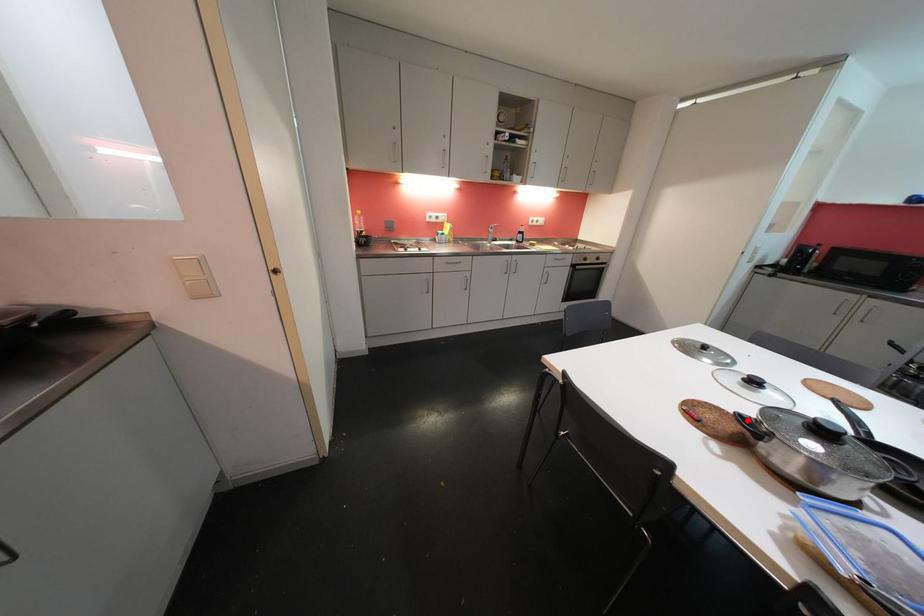
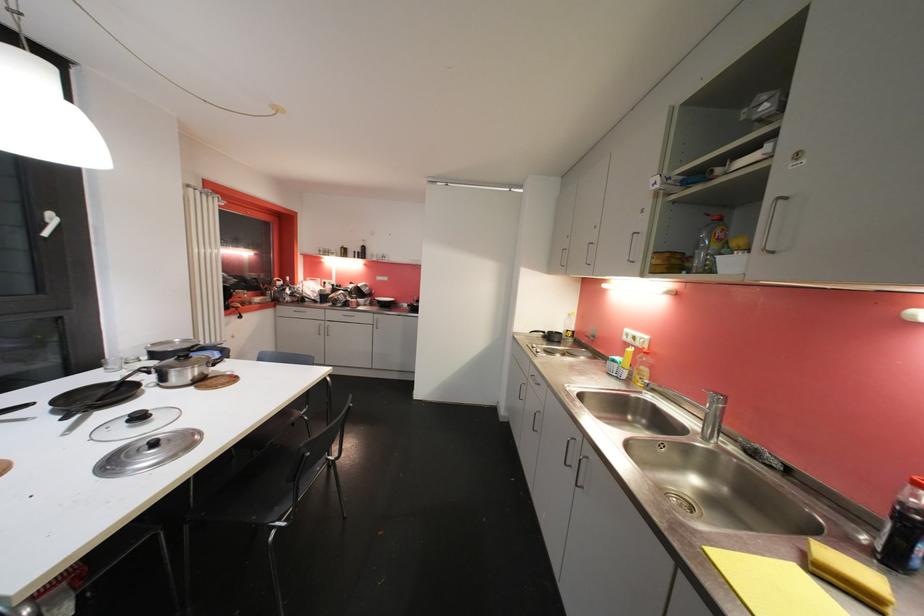
Question: I am providing you with two images of the same scene from different viewpoints. Image1 has a red point marked. In image2, the corresponding 3D location appears at what relative position? Reply with the corresponding letter.

Choices:
 (A) Closer
 (B) Farther

Answer: (A)